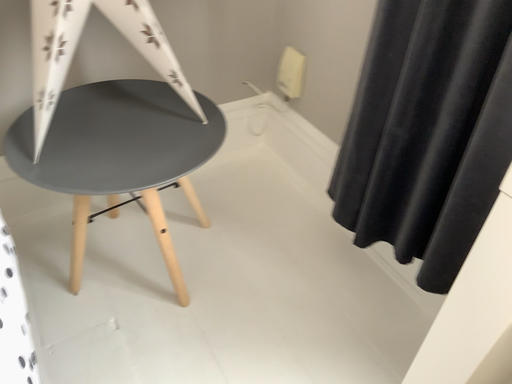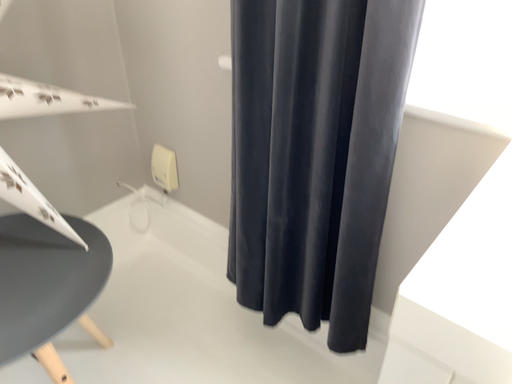
Question: Which way did the camera rotate in the video?

Choices:
 (A) rotated left
 (B) rotated right

Answer: (B)